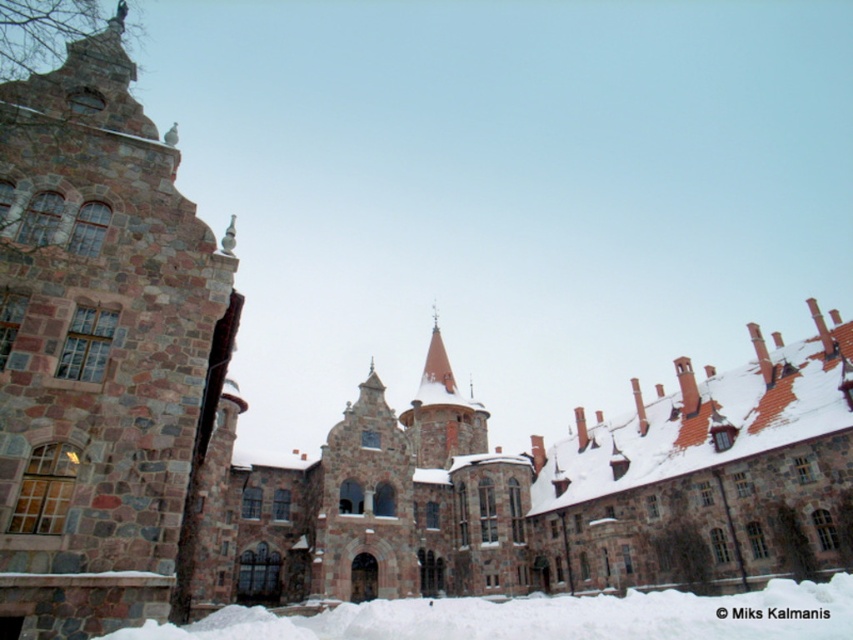
Question: Is rustic stone tower at left smaller than white fluffy snow at lower center?

Choices:
 (A) no
 (B) yes

Answer: (B)

Question: Is rustic stone tower at left to the right of white fluffy snow at lower center from the viewer's perspective?

Choices:
 (A) no
 (B) yes

Answer: (A)

Question: Among these objects, which one is farthest from the camera?

Choices:
 (A) rustic stone tower at left
 (B) white fluffy snow at lower center

Answer: (A)

Question: Is rustic stone tower at left to the left of white fluffy snow at lower center from the viewer's perspective?

Choices:
 (A) yes
 (B) no

Answer: (A)